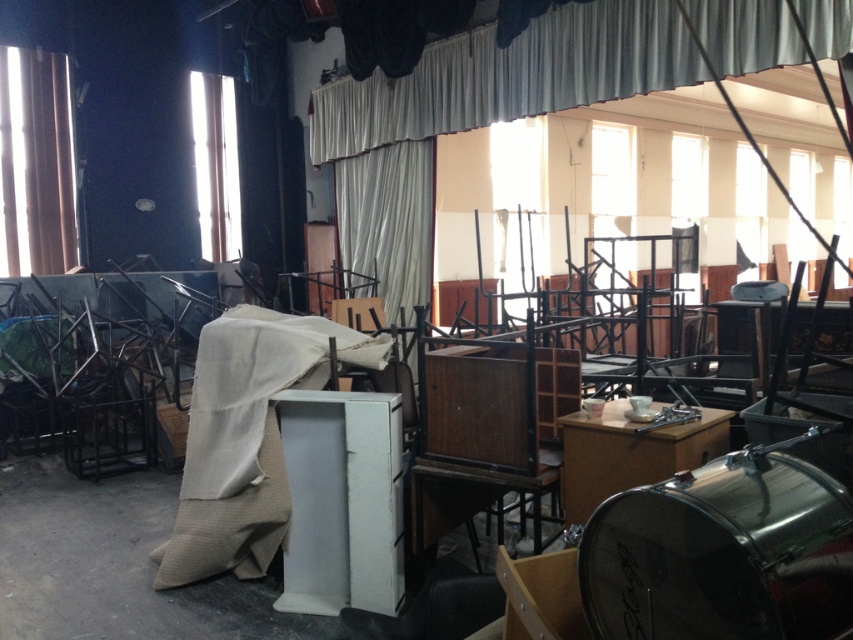
Question: Where is white fabric curtain at upper center located in relation to beige fabric at center in the image?

Choices:
 (A) above
 (B) below

Answer: (A)

Question: Can you confirm if beige fabric at center is positioned to the left of brown fabric curtain at left?

Choices:
 (A) yes
 (B) no

Answer: (B)

Question: Estimate the real-world distances between objects in this image. Which object is farther from the white fabric curtain at upper center?

Choices:
 (A) beige fabric at center
 (B) wooden cabinet at center

Answer: (A)

Question: Which of the following is the closest to the observer?

Choices:
 (A) beige fabric at center
 (B) white fabric curtain at upper center
 (C) brown fabric curtain at left

Answer: (A)

Question: Can you confirm if white fabric curtain at upper center is positioned to the right of wooden cabinet at center?

Choices:
 (A) no
 (B) yes

Answer: (B)

Question: Based on their relative distances, which object is farther from the wooden cabinet at center?

Choices:
 (A) white fabric curtain at upper center
 (B) beige fabric at center
 (C) brown fabric curtain at left

Answer: (C)